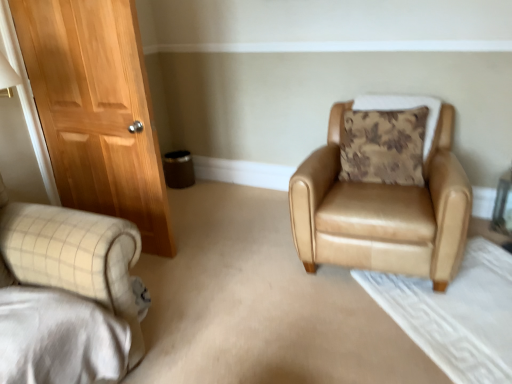
In order to face brown floral cushion at upper right, should I rotate leftwards or rightwards?

Rotate your view right by about 18.046°.

The image size is (512, 384). Describe the element at coordinates (383, 146) in the screenshot. I see `brown floral cushion at upper right` at that location.

The width and height of the screenshot is (512, 384). What are the coordinates of `brown floral cushion at upper right` in the screenshot? It's located at (383, 146).

This screenshot has width=512, height=384. What do you see at coordinates (382, 211) in the screenshot?
I see `tan leather armchair at center-right` at bounding box center [382, 211].

Locate an element on the screen. The image size is (512, 384). tan leather armchair at center-right is located at coordinates (382, 211).

Find the location of `brown floral cushion at upper right`. brown floral cushion at upper right is located at coordinates (383, 146).

Does tan leather armchair at center-right appear on the left side of brown floral cushion at upper right?

Yes.

Considering the positions of objects tan leather armchair at center-right and brown floral cushion at upper right in the image provided, who is behind, tan leather armchair at center-right or brown floral cushion at upper right?

brown floral cushion at upper right is further away from the camera.

Which point is more distant from viewer, [334,210] or [420,108]?

The point [420,108] is farther from the camera.

From the image's perspective, which one is positioned lower, tan leather armchair at center-right or brown floral cushion at upper right?

tan leather armchair at center-right, from the image's perspective.

From a real-world perspective, is tan leather armchair at center-right above or below brown floral cushion at upper right?

tan leather armchair at center-right is below brown floral cushion at upper right.

Does tan leather armchair at center-right have a greater width compared to brown floral cushion at upper right?

Indeed, tan leather armchair at center-right has a greater width compared to brown floral cushion at upper right.

Considering the sizes of tan leather armchair at center-right and brown floral cushion at upper right in the image, is tan leather armchair at center-right taller or shorter than brown floral cushion at upper right?

In the image, tan leather armchair at center-right appears to be taller than brown floral cushion at upper right.

Considering the sizes of objects tan leather armchair at center-right and brown floral cushion at upper right in the image provided, who is bigger, tan leather armchair at center-right or brown floral cushion at upper right?

tan leather armchair at center-right is bigger.

Consider the image. Is brown floral cushion at upper right completely or partially inside tan leather armchair at center-right?

Yes, tan leather armchair at center-right contains brown floral cushion at upper right.

Are tan leather armchair at center-right and brown floral cushion at upper right making contact?

No.

Is tan leather armchair at center-right oriented towards brown floral cushion at upper right?

No, tan leather armchair at center-right does not turn towards brown floral cushion at upper right.

Can you tell me how much tan leather armchair at center-right and brown floral cushion at upper right differ in facing direction?

The angular difference between tan leather armchair at center-right and brown floral cushion at upper right is 5.81 degrees.

At what (x,y) coordinates should I click in order to perform the action: click on chair below the brown floral cushion at upper right (from the image's perspective). Please return your answer as a coordinate pair (x, y). This screenshot has width=512, height=384. Looking at the image, I should click on (382, 211).

Considering the relative positions of brown floral cushion at upper right and tan leather armchair at center-right in the image provided, is brown floral cushion at upper right to the right of tan leather armchair at center-right from the viewer's perspective?

Correct, you'll find brown floral cushion at upper right to the right of tan leather armchair at center-right.

Is the depth of brown floral cushion at upper right less than that of tan leather armchair at center-right?

No.

Between point (340, 129) and point (308, 214), which one is positioned in front?

The point (308, 214) is closer to the camera.

From the image's perspective, which object appears higher, brown floral cushion at upper right or tan leather armchair at center-right?

brown floral cushion at upper right appears higher in the image.

From a real-world perspective, relative to tan leather armchair at center-right, is brown floral cushion at upper right vertically above or below?

Clearly, from a real-world perspective, brown floral cushion at upper right is above tan leather armchair at center-right.

Consider the image. Can you confirm if brown floral cushion at upper right is wider than tan leather armchair at center-right?

In fact, brown floral cushion at upper right might be narrower than tan leather armchair at center-right.

Between brown floral cushion at upper right and tan leather armchair at center-right, which one has less height?

Standing shorter between the two is brown floral cushion at upper right.

Considering the relative sizes of brown floral cushion at upper right and tan leather armchair at center-right in the image provided, is brown floral cushion at upper right bigger than tan leather armchair at center-right?

Incorrect, brown floral cushion at upper right is not larger than tan leather armchair at center-right.

Does brown floral cushion at upper right contain tan leather armchair at center-right?

No, brown floral cushion at upper right does not contain tan leather armchair at center-right.

Is brown floral cushion at upper right next to tan leather armchair at center-right?

There is a gap between brown floral cushion at upper right and tan leather armchair at center-right.

Does brown floral cushion at upper right turn towards tan leather armchair at center-right?

Yes, brown floral cushion at upper right faces towards tan leather armchair at center-right.

Where is `pillow above the tan leather armchair at center-right (from the image's perspective)`? pillow above the tan leather armchair at center-right (from the image's perspective) is located at coordinates (383, 146).

In the image, there is a brown floral cushion at upper right. Identify the location of chair below it (from the image's perspective). (382, 211).

Image resolution: width=512 pixels, height=384 pixels. In order to click on pillow behind the tan leather armchair at center-right in this screenshot , I will do `click(383, 146)`.